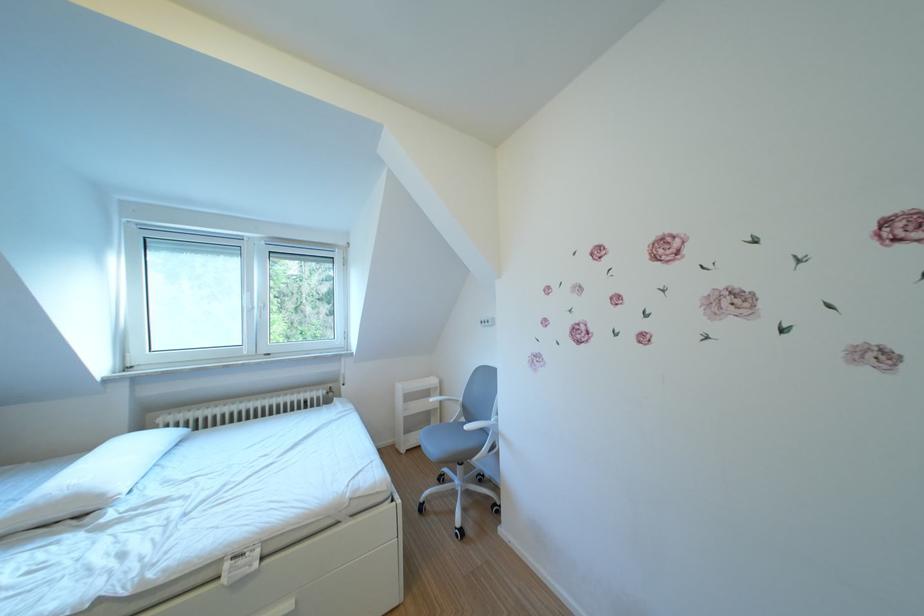
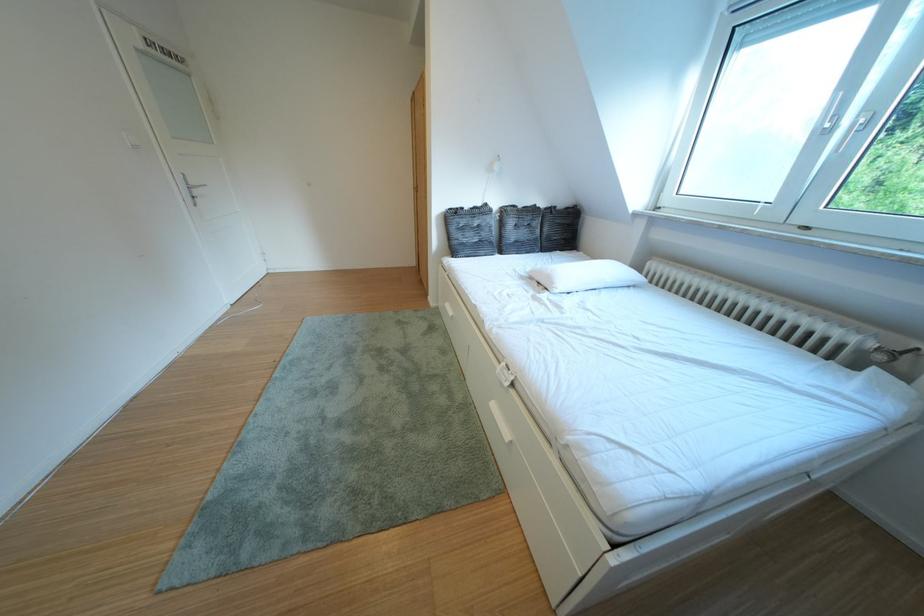
The point at (115, 501) is marked in the first image. Where is the corresponding point in the second image?

(565, 288)